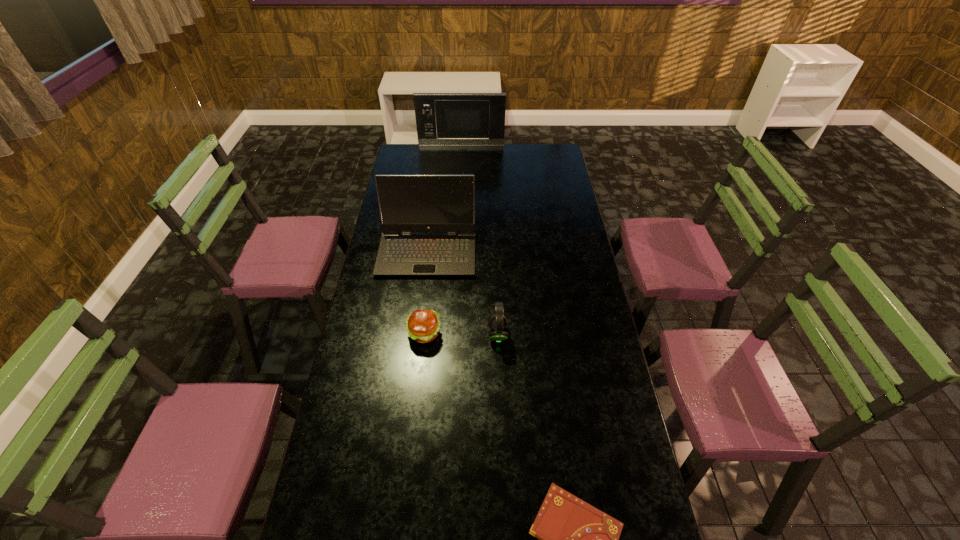
Locate an element on the screen. Image resolution: width=960 pixels, height=540 pixels. vacant space that satisfies the following two spatial constraints: 1. on the screen of the hamburger; 2. on the right side of the laptop computer is located at coordinates (418, 334).